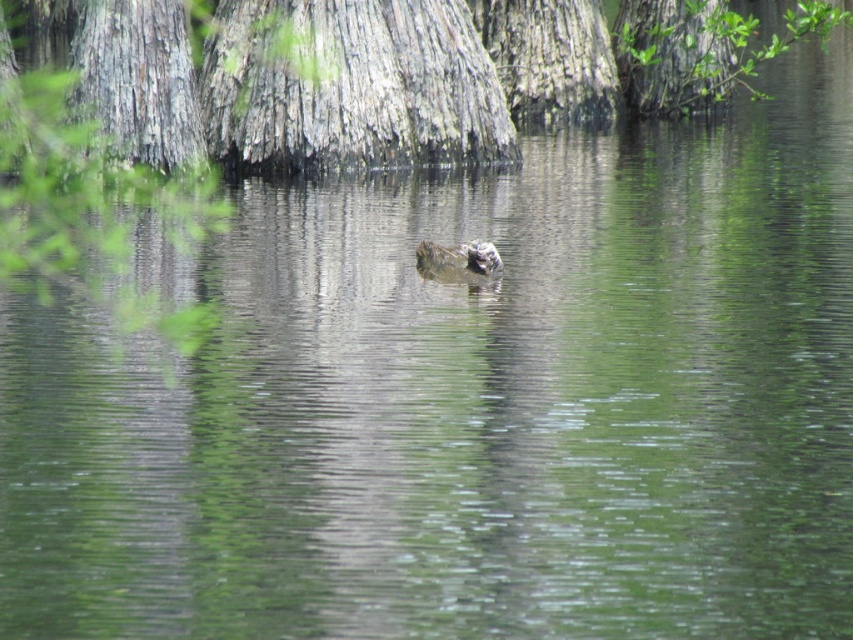
You are a birdwatcher observing the scene. You notice the gray textured bark at upper center and the green leafy tree at upper right. Which of these two objects has a greater width in the image?

The gray textured bark at upper center has a greater width than the green leafy tree at upper right.

You are a wildlife photographer trying to capture a close shot of the brown fuzzy duck at center. You are currently positioned near the gray textured bark at upper center. Given that your camera lens has a maximum focus range of 30 feet, will you be able to take a clear photo of the duck?

The distance between the gray textured bark at upper center and the brown fuzzy duck at center is 30.02 feet. Since the camera lens can only focus up to 30 feet, the distance is slightly beyond the maximum range. Therefore, you won

Based on the photo, you are a photographer standing at the edge of the water scene. You want to take a photo that includes both the bird and the tree trunks. You have two points marked on your viewfinder at coordinates point (257, 147) and point (436, 262). Which point is closer to you, the photographer?

Point (436, 262) is closer to you because the description states that point (257, 147) is behind point (436, 262).